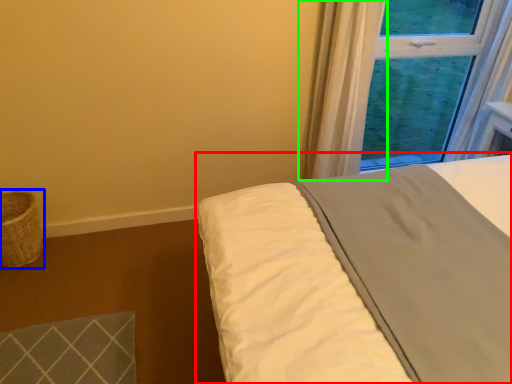
Question: Which is nearer to the bed (highlighted by a red box)? basket (highlighted by a blue box) or curtain (highlighted by a green box).

Choices:
 (A) basket
 (B) curtain

Answer: (B)